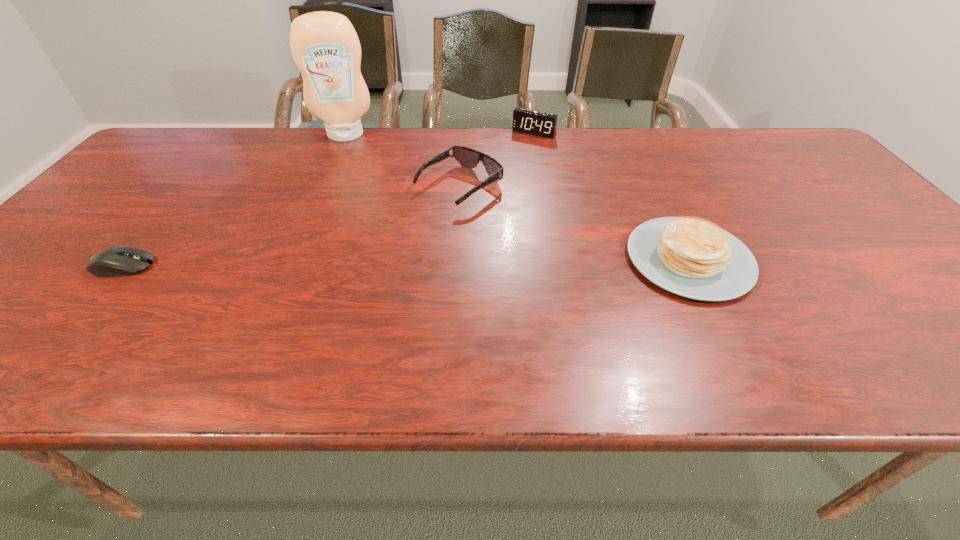
Locate an element on the screen. This screenshot has height=540, width=960. condiment located at the far edge is located at coordinates (324, 45).

Where is `alarm clock present at the far edge`? This screenshot has height=540, width=960. alarm clock present at the far edge is located at coordinates (542, 124).

At what (x,y) coordinates should I click in order to perform the action: click on object located in the near edge section of the desktop. Please return your answer as a coordinate pair (x, y). Image resolution: width=960 pixels, height=540 pixels. Looking at the image, I should click on (692, 257).

Locate an element on the screen. This screenshot has width=960, height=540. object that is at the left edge is located at coordinates (116, 261).

Locate an element on the screen. The height and width of the screenshot is (540, 960). free space at the far edge of the desktop is located at coordinates [x=303, y=127].

The image size is (960, 540). In the image, there is a desktop. In order to click on vacant area at the near edge in this screenshot , I will do `click(305, 306)`.

Identify the location of vacant space at the left edge. (46, 295).

This screenshot has height=540, width=960. Identify the location of vacant space at the right edge. (820, 215).

The height and width of the screenshot is (540, 960). In the image, there is a desktop. Find the location of `vacant area at the far left corner`. vacant area at the far left corner is located at coordinates (198, 158).

Locate an element on the screen. vacant space at the far right corner of the desktop is located at coordinates (760, 132).